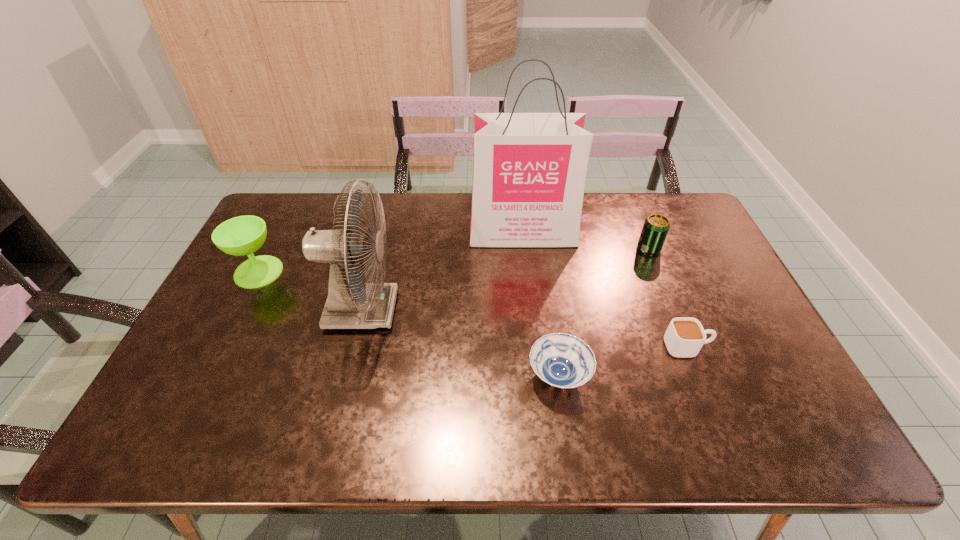
In the image, there is a desktop. Identify the location of vacant space at the far left corner. This screenshot has width=960, height=540. (276, 215).

Where is `free space at the far right corner of the desktop`? This screenshot has height=540, width=960. free space at the far right corner of the desktop is located at coordinates coord(663,194).

This screenshot has height=540, width=960. I want to click on free space that is in between the leftmost object and the cup, so click(472, 309).

Where is `free space between the shopping bag and the third tallest object`? free space between the shopping bag and the third tallest object is located at coordinates (391, 252).

What are the coordinates of `empty location between the cup and the tallest object` in the screenshot? It's located at (605, 290).

You are a GUI agent. You are given a task and a screenshot of the screen. Output one action in this format:
    pyautogui.click(x=<x>, y=<y>)
    Task: Click on the free area in between the fan and the soup bowl
    This screenshot has height=540, width=960.
    Given the screenshot: What is the action you would take?
    pyautogui.click(x=461, y=343)

Find the location of a particular element. The width and height of the screenshot is (960, 540). free spot between the fourth tallest object and the soup bowl is located at coordinates (604, 312).

At what (x,y) coordinates should I click in order to perform the action: click on free space between the soup bowl and the tallest object. Please return your answer as a coordinate pair (x, y). The width and height of the screenshot is (960, 540). Looking at the image, I should click on coord(540,305).

At what (x,y) coordinates should I click in order to perform the action: click on vacant area that lies between the tallest object and the wineglass. Please return your answer as a coordinate pair (x, y). This screenshot has height=540, width=960. Looking at the image, I should click on (391, 252).

This screenshot has height=540, width=960. Find the location of `free spot between the tallest object and the third tallest object`. free spot between the tallest object and the third tallest object is located at coordinates (391, 252).